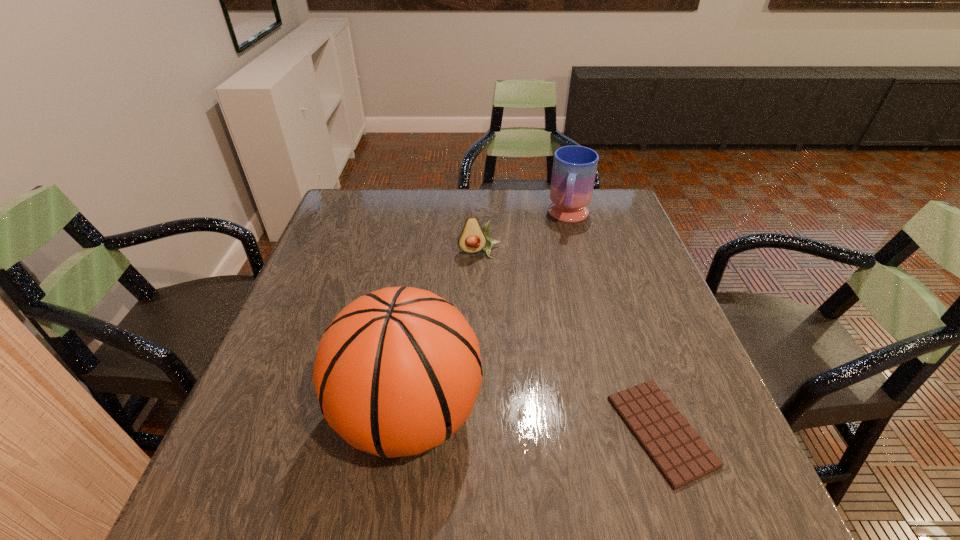
What are the coordinates of `vacant space on the desktop that is between the tallest object and the chocolate bar and is positioned on the seed side of the avocado` in the screenshot? It's located at (514, 421).

Where is `vacant space on the desktop that is between the basketball and the chocolate bar and is positioned on the side of the third shortest object with the handle`? The image size is (960, 540). vacant space on the desktop that is between the basketball and the chocolate bar and is positioned on the side of the third shortest object with the handle is located at coordinates (525, 422).